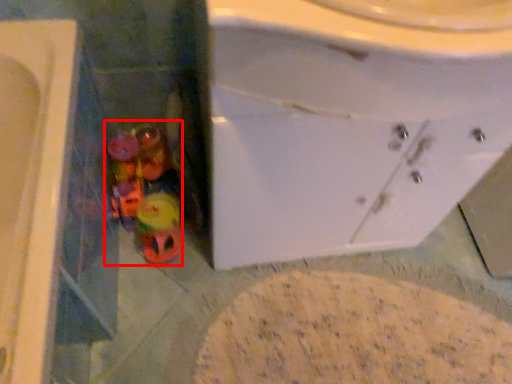
Question: Considering the relative positions of toy (annotated by the red box) and sink in the image provided, where is toy (annotated by the red box) located with respect to the staircase?

Choices:
 (A) right
 (B) left

Answer: (B)